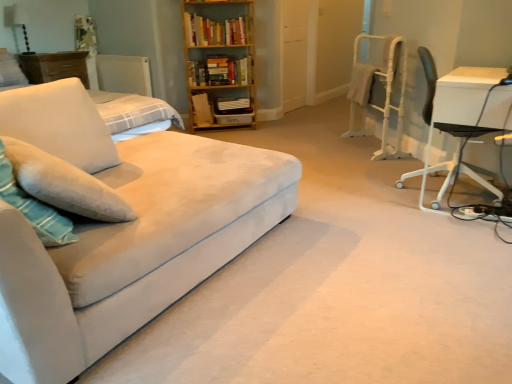
Question: In terms of width, does white fabric lampshade at upper left look wider or thinner when compared to white soft pillow at upper left, the 1th pillow positioned from the top?

Choices:
 (A) wide
 (B) thin

Answer: (B)

Question: From their relative heights in the image, would you say white fabric lampshade at upper left is taller or shorter than white soft pillow at upper left, placed as the first pillow when sorted from back to front?

Choices:
 (A) short
 (B) tall

Answer: (B)

Question: Which object is positioned closest to the white soft pillow at left, which is counted as the first pillow, starting from the right?

Choices:
 (A) white matte radiator at upper left
 (B) wooden dresser at upper left
 (C) white metal computer chair at right
 (D) white soft pillow at upper left, which is the 2th pillow in front-to-back order
 (E) white fabric lampshade at upper left

Answer: (D)

Question: Which object is the farthest from the suede-like beige couch at left?

Choices:
 (A) white soft pillow at upper left, which is the 2th pillow from right to left
 (B) white soft pillow at left, the 2th pillow from the back
 (C) white fabric lampshade at upper left
 (D) wooden bookshelf at upper center, arranged as the 1th book when viewed from the top
 (E) wooden bookshelf at upper center

Answer: (C)